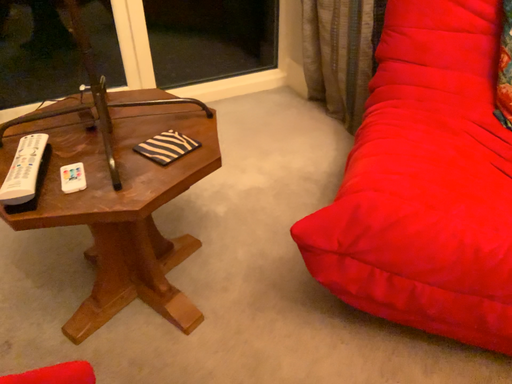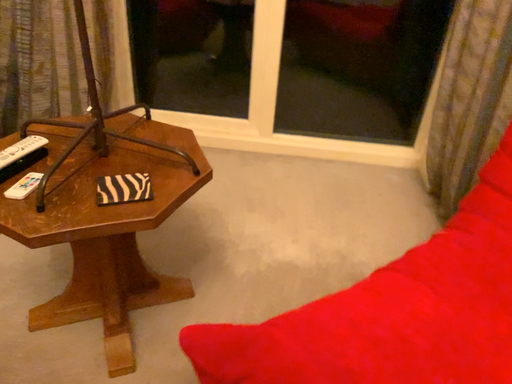
Question: Which way did the camera rotate in the video?

Choices:
 (A) rotated right
 (B) rotated left

Answer: (B)